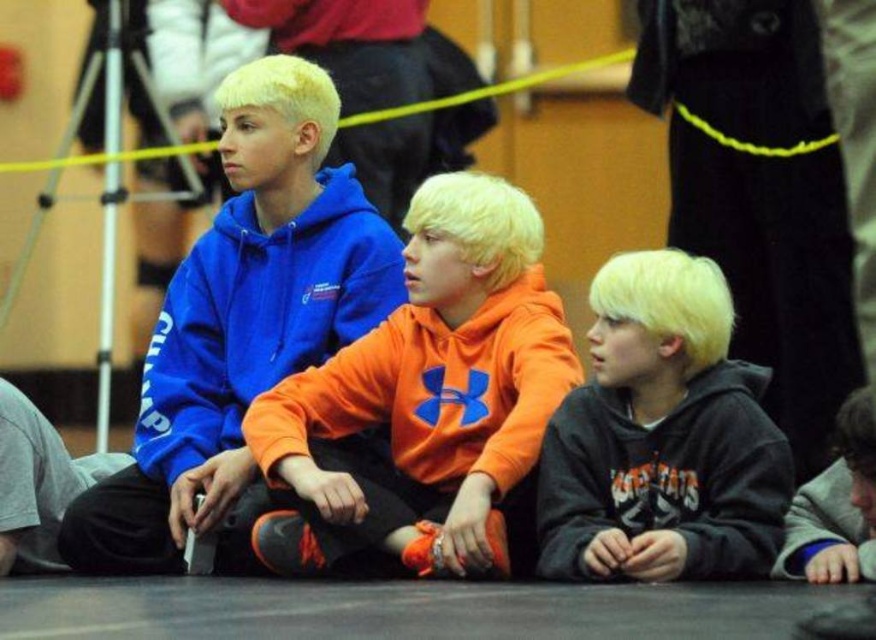
Question: Does matte blue hoodie at upper left appear on the left side of matte blue hoodie at left?

Choices:
 (A) yes
 (B) no

Answer: (B)

Question: Which of the following is the farthest from the observer?

Choices:
 (A) orange fleece sweatshirt at center
 (B) matte blue hoodie at upper left

Answer: (B)

Question: Observing the image, what is the correct spatial positioning of orange fleece sweatshirt at center in reference to black matte hoodie at center?

Choices:
 (A) left
 (B) right

Answer: (A)

Question: Does matte blue hoodie at upper left appear under matte blue hoodie at left?

Choices:
 (A) yes
 (B) no

Answer: (A)

Question: Which is nearer to the matte blue hoodie at left?

Choices:
 (A) orange fleece sweatshirt at center
 (B) matte blue hoodie at upper left
 (C) black matte hoodie at center

Answer: (B)

Question: Which point is farther to the camera?

Choices:
 (A) (139, 419)
 (B) (94, 563)
 (C) (320, 512)
 (D) (569, 413)

Answer: (A)